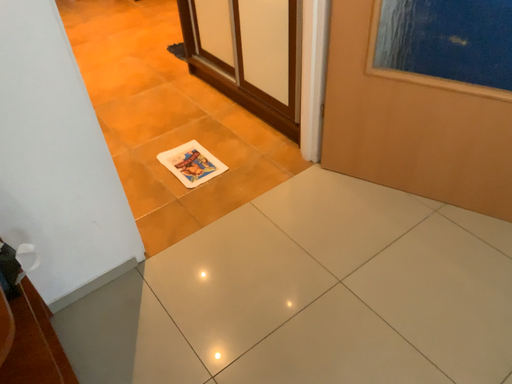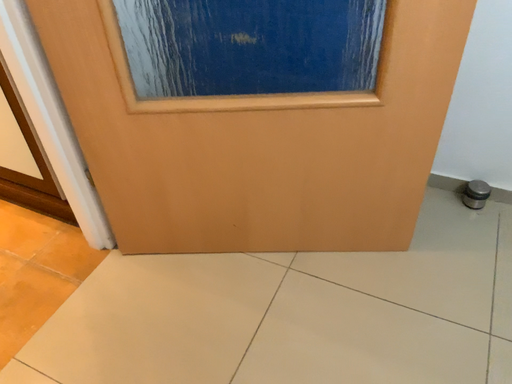
Question: How did the camera likely rotate when shooting the video?

Choices:
 (A) rotated upward
 (B) rotated downward

Answer: (A)